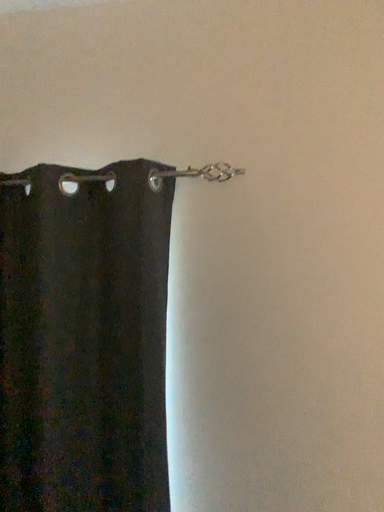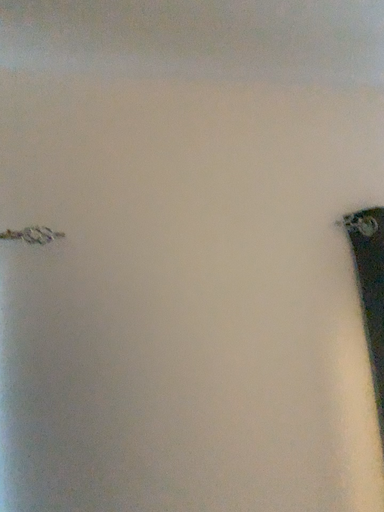
Question: How did the camera likely rotate when shooting the video?

Choices:
 (A) rotated downward
 (B) rotated upward

Answer: (B)